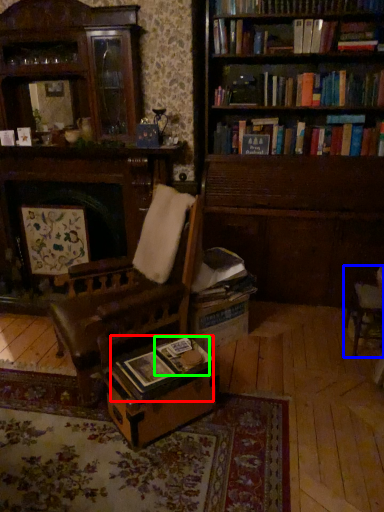
Question: Which object is positioned closest to book (highlighted by a red box)? Select from chair (highlighted by a blue box) and paperback book (highlighted by a green box).

Choices:
 (A) chair
 (B) paperback book

Answer: (B)